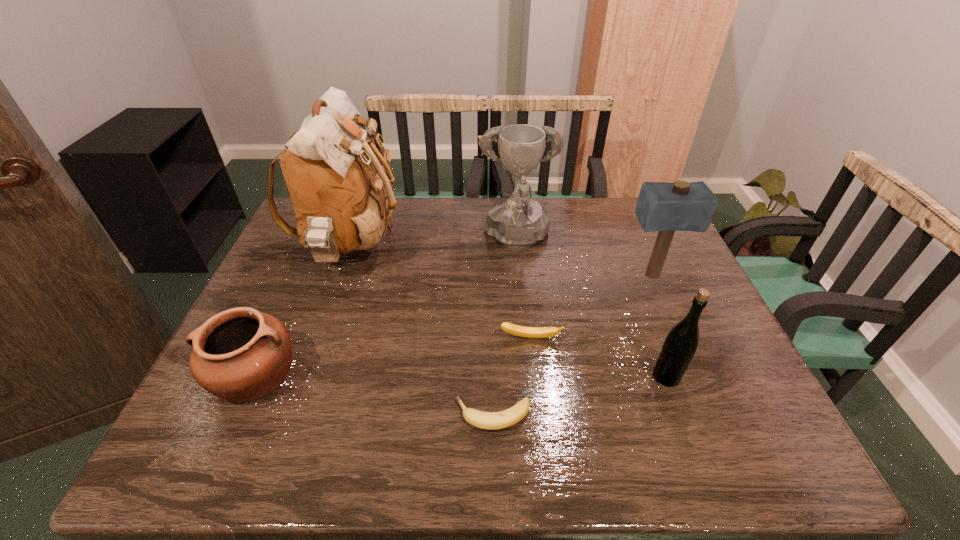
Identify the location of object identified as the third closest to the beer bottle. (485, 420).

Where is `vacant space that satisfies the following two spatial constraints: 1. on the side with emblem of the second tallest object; 2. at the stem of the shorter banana`? The height and width of the screenshot is (540, 960). vacant space that satisfies the following two spatial constraints: 1. on the side with emblem of the second tallest object; 2. at the stem of the shorter banana is located at coordinates (535, 415).

Where is `vacant area in the image that satisfies the following two spatial constraints: 1. on the front side of the beer bottle; 2. on the left side of the pottery`? vacant area in the image that satisfies the following two spatial constraints: 1. on the front side of the beer bottle; 2. on the left side of the pottery is located at coordinates (253, 376).

Locate an element on the screen. This screenshot has height=540, width=960. vacant area that satisfies the following two spatial constraints: 1. at the stem of the farther banana; 2. at the stem of the shortest object is located at coordinates (539, 415).

Where is `vacant position in the image that satisfies the following two spatial constraints: 1. on the front-facing side of the beer bottle; 2. on the right side of the tallest object`? vacant position in the image that satisfies the following two spatial constraints: 1. on the front-facing side of the beer bottle; 2. on the right side of the tallest object is located at coordinates (307, 376).

In order to click on vacant space that satisfies the following two spatial constraints: 1. on the front side of the mallet; 2. at the stem of the shortest object in this screenshot , I will do `click(711, 415)`.

You are a GUI agent. You are given a task and a screenshot of the screen. Output one action in this format:
    pyautogui.click(x=<x>, y=<y>)
    Task: Click on the free region that satisfies the following two spatial constraints: 1. on the front side of the beer bottle; 2. at the stem of the shortest object
    Image resolution: width=960 pixels, height=540 pixels.
    Given the screenshot: What is the action you would take?
    pyautogui.click(x=681, y=415)

This screenshot has width=960, height=540. Identify the location of free space that satisfies the following two spatial constraints: 1. at the stem of the beer bottle; 2. on the left side of the farther banana. (535, 376).

This screenshot has height=540, width=960. Find the location of `vacant region that satisfies the following two spatial constraints: 1. on the side with emblem of the mallet; 2. on the left side of the award`. vacant region that satisfies the following two spatial constraints: 1. on the side with emblem of the mallet; 2. on the left side of the award is located at coordinates (520, 275).